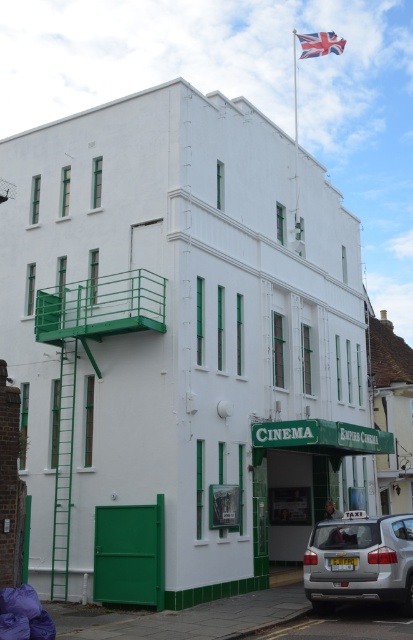
Question: Does silver metallic taxi at lower right lie behind union jack fabric at upper center?

Choices:
 (A) yes
 (B) no

Answer: (B)

Question: Which object is farther from the camera taking this photo?

Choices:
 (A) silver metallic taxi at lower right
 (B) union jack fabric at upper center

Answer: (B)

Question: Does silver metallic taxi at lower right appear under union jack fabric at upper center?

Choices:
 (A) yes
 (B) no

Answer: (A)

Question: Is silver metallic taxi at lower right to the right of union jack fabric at upper center from the viewer's perspective?

Choices:
 (A) no
 (B) yes

Answer: (A)

Question: Which object is farther from the camera taking this photo?

Choices:
 (A) silver metallic taxi at lower right
 (B) union jack fabric at upper center

Answer: (B)